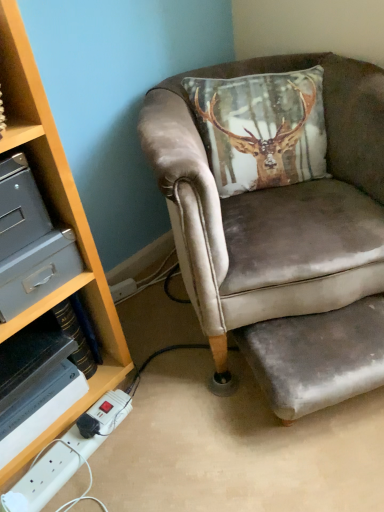
Question: Should I look upward or downward to see white plastic power strip at lower left?

Choices:
 (A) up
 (B) down

Answer: (B)

Question: Does velvet grey footrest at lower right lie behind velvet brown armchair at center?

Choices:
 (A) no
 (B) yes

Answer: (B)

Question: From the image's perspective, does velvet grey footrest at lower right appear lower than velvet brown armchair at center?

Choices:
 (A) no
 (B) yes

Answer: (B)

Question: Does velvet grey footrest at lower right have a smaller size compared to velvet brown armchair at center?

Choices:
 (A) yes
 (B) no

Answer: (A)

Question: From a real-world perspective, is velvet grey footrest at lower right on top of velvet brown armchair at center?

Choices:
 (A) no
 (B) yes

Answer: (A)

Question: Is velvet grey footrest at lower right at the left side of velvet brown armchair at center?

Choices:
 (A) no
 (B) yes

Answer: (A)

Question: Does velvet grey footrest at lower right have a lesser height compared to velvet brown armchair at center?

Choices:
 (A) no
 (B) yes

Answer: (B)

Question: From the image's perspective, is white plastic power strip at lower left on metallic gray drawer at left?

Choices:
 (A) yes
 (B) no

Answer: (B)

Question: Is white plastic power strip at lower left with metallic gray drawer at left?

Choices:
 (A) no
 (B) yes

Answer: (A)

Question: Considering the relative sizes of white plastic power strip at lower left and metallic gray drawer at left in the image provided, is white plastic power strip at lower left shorter than metallic gray drawer at left?

Choices:
 (A) yes
 (B) no

Answer: (A)

Question: Considering the relative positions of white plastic power strip at lower left and metallic gray drawer at left in the image provided, is white plastic power strip at lower left to the right of metallic gray drawer at left from the viewer's perspective?

Choices:
 (A) yes
 (B) no

Answer: (A)

Question: Can you confirm if white plastic power strip at lower left is taller than metallic gray drawer at left?

Choices:
 (A) yes
 (B) no

Answer: (B)

Question: From a real-world perspective, is white plastic power strip at lower left located higher than metallic gray drawer at left?

Choices:
 (A) no
 (B) yes

Answer: (A)

Question: From the image's perspective, is white plastic power strip at lower left under velvet grey footrest at lower right?

Choices:
 (A) yes
 (B) no

Answer: (A)